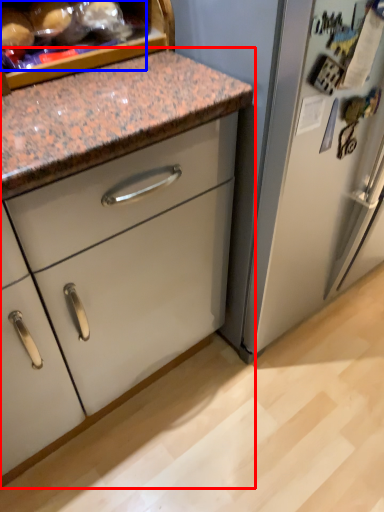
Question: Which point is further to the camera, cabinetry (highlighted by a red box) or food (highlighted by a blue box)?

Choices:
 (A) cabinetry
 (B) food

Answer: (A)